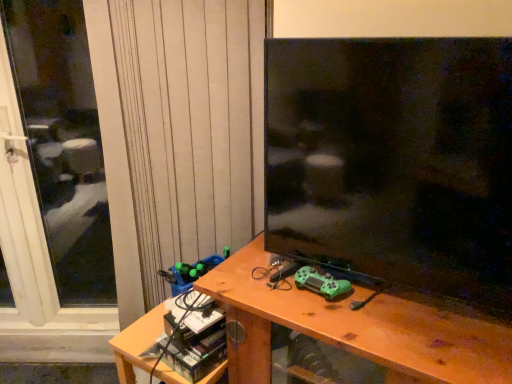
The width and height of the screenshot is (512, 384). Find the location of `free point in front of green matte game controller at center, which appears as the 1th toy when viewed from the front`. free point in front of green matte game controller at center, which appears as the 1th toy when viewed from the front is located at coordinates tap(339, 320).